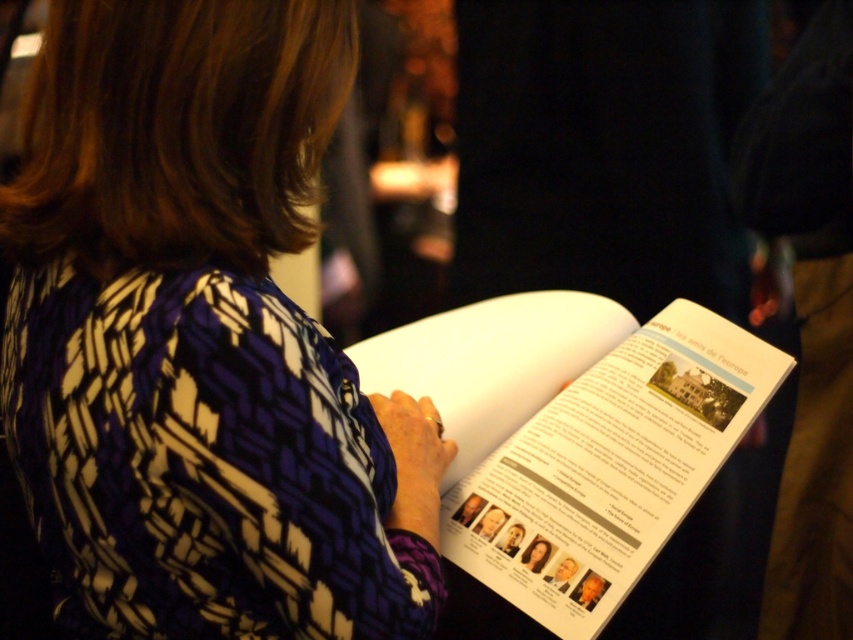
You are organizing a clothing and book fair. You have a printed fabric shirt at center and a white paper book at center. Which item is narrower?

A: The printed fabric shirt at center has a lesser width compared to the white paper book at center, so the printed fabric shirt at center is narrower.

You are standing in a room with a person holding an open book. There is a point at coordinates (418, 449). Can you reach this point without moving closer to the person?

The point at coordinates (418, 449) is 3.52 feet away from the viewer, so yes, you can reach it without moving closer to the person if your arm or tool can extend 3.52 feet.

You are a photographer at an event and notice a person holding a book. You want to take a clear photo of the white paper book at center without the printed fabric shirt at center blocking it. What should you do?

The printed fabric shirt at center is in front of the white paper book at center, so to take a clear photo of the white paper book at center without obstruction, you should move the printed fabric shirt at center out of the way or adjust the angle to ensure it does not block the book.